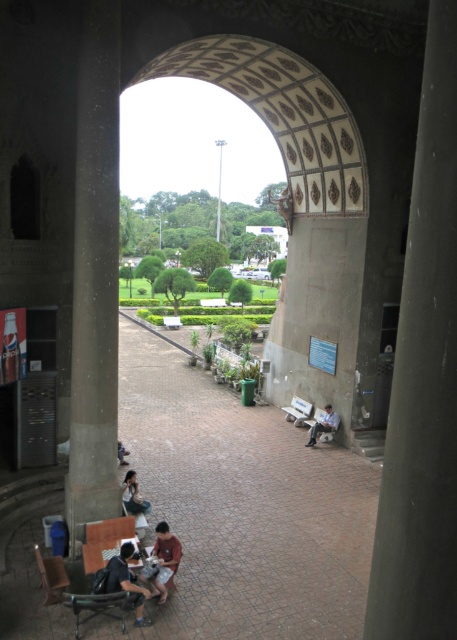
Which is more to the right, brown leather jacket at lower center or matte black dress at lower center?

brown leather jacket at lower center is more to the right.

At what (x,y) coordinates should I click in order to perform the action: click on brown leather jacket at lower center. Please return your answer as a coordinate pair (x, y). Looking at the image, I should click on (164, 561).

Is dark blue shirt at lower left below brown leather jacket at lower center?

Correct, dark blue shirt at lower left is located below brown leather jacket at lower center.

Identify the location of dark blue shirt at lower left. The width and height of the screenshot is (457, 640). (127, 580).

Is point (139, 589) farther from viewer compared to point (158, 550)?

No, it is not.

Find the location of a particular element. dark blue shirt at lower left is located at coordinates (127, 580).

Is dark gray concrete pillar at center thinner than brown leather jacket at lower center?

Correct, dark gray concrete pillar at center's width is less than brown leather jacket at lower center's.

Can you confirm if dark gray concrete pillar at center is positioned below brown leather jacket at lower center?

Actually, dark gray concrete pillar at center is above brown leather jacket at lower center.

The image size is (457, 640). I want to click on dark gray concrete pillar at center, so click(424, 380).